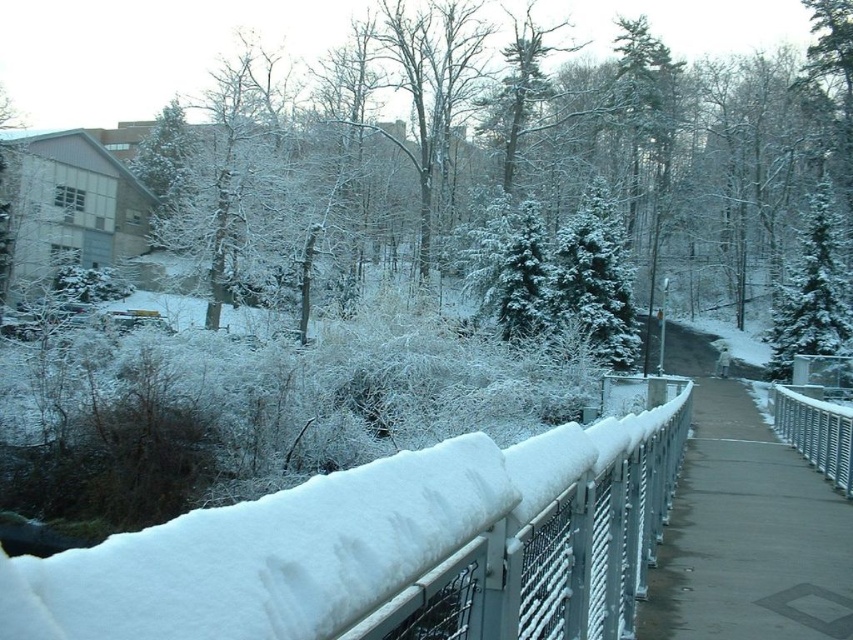
Which is more to the right, snow-covered metal fence at center or silver metallic fence at right?

silver metallic fence at right is more to the right.

Describe the element at coordinates (556, 538) in the screenshot. The height and width of the screenshot is (640, 853). I see `snow-covered metal fence at center` at that location.

The height and width of the screenshot is (640, 853). In order to click on snow-covered metal fence at center in this screenshot , I will do `click(556, 538)`.

Which of these two, snow-covered metal fence at center or gray concrete pavement at center, stands taller?

With more height is snow-covered metal fence at center.

Is point (664, 449) more distant than point (813, 548)?

Yes.

Is point (558, 509) closer to camera compared to point (788, 540)?

Yes, it is in front of point (788, 540).

Where is `snow-covered metal fence at center`? snow-covered metal fence at center is located at coordinates (556, 538).

Between snow-covered evergreen at upper right and silver metallic fence at right, which one is positioned lower?

silver metallic fence at right is lower down.

Does snow-covered evergreen at upper right appear on the left side of silver metallic fence at right?

In fact, snow-covered evergreen at upper right is to the right of silver metallic fence at right.

The image size is (853, 640). Describe the element at coordinates (811, 291) in the screenshot. I see `snow-covered evergreen at upper right` at that location.

At what (x,y) coordinates should I click in order to perform the action: click on snow-covered evergreen at upper right. Please return your answer as a coordinate pair (x, y). Looking at the image, I should click on (811, 291).